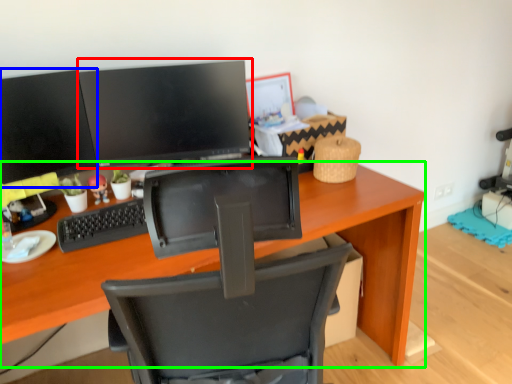
Question: Which object is the farthest from computer monitor (highlighted by a red box)? Choose among these: computer monitor (highlighted by a blue box) or desk (highlighted by a green box).

Choices:
 (A) computer monitor
 (B) desk

Answer: (B)